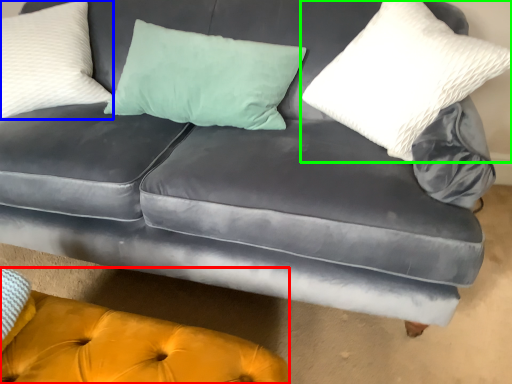
Question: Estimate the real-world distances between objects in this image. Which object is closer to couch (highlighted by a red box), pillow (highlighted by a blue box) or pillow (highlighted by a green box)?

Choices:
 (A) pillow
 (B) pillow

Answer: (B)